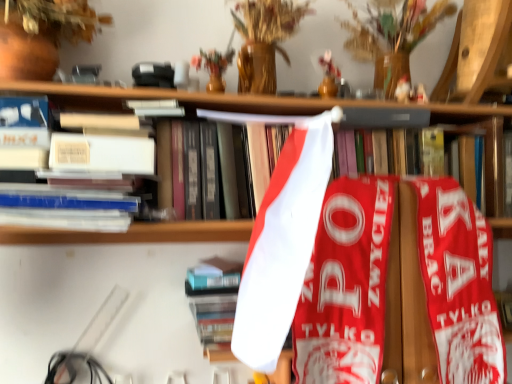
Find the location of a particular element. This screenshot has height=384, width=512. free space above white paper at upper center, positioned as the 1th book in top-to-bottom order (from a real-world perspective) is located at coordinates (360, 111).